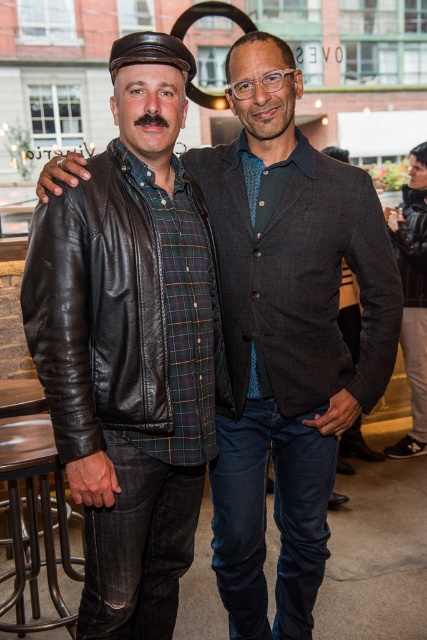
You are a photographer standing at the center of the scene. You want to place a metallic silver stool at lower left in the frame. Where exactly should you position it?

The metallic silver stool at lower left should be positioned at point (35, 515) to align with the scene.

You are a photographer trying to capture a clear shot of both the shiny black leather jacket at left and the leather jacket at lower right. Which jacket should you focus on first to ensure it appears in the foreground?

The shiny black leather jacket at left should be focused on first because it is positioned under the leather jacket at lower right, meaning it is closer to the camera and thus in the foreground.